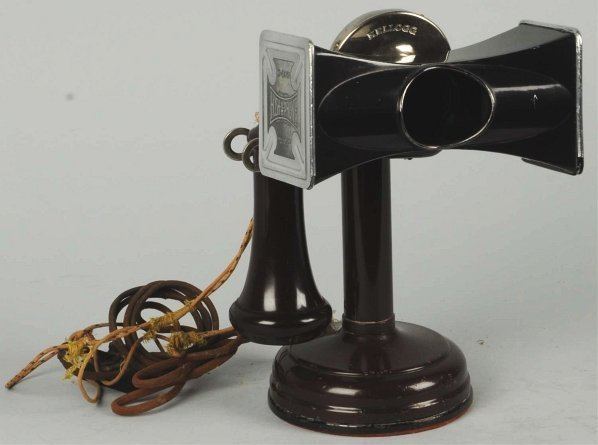
Locate an element on the screen. stand base is located at coordinates (411, 385).